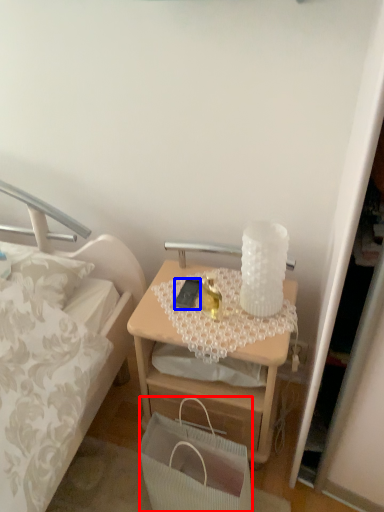
Question: Which object appears closest to the camera in this image, handbag (highlighted by a red box) or mobile phone (highlighted by a blue box)?

Choices:
 (A) handbag
 (B) mobile phone

Answer: (A)